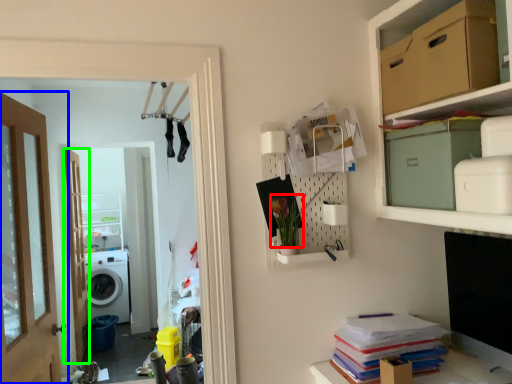
Question: Which object is positioned closest to plant (highlighted by a red box)? Select from door (highlighted by a blue box) and door (highlighted by a green box).

Choices:
 (A) door
 (B) door

Answer: (A)